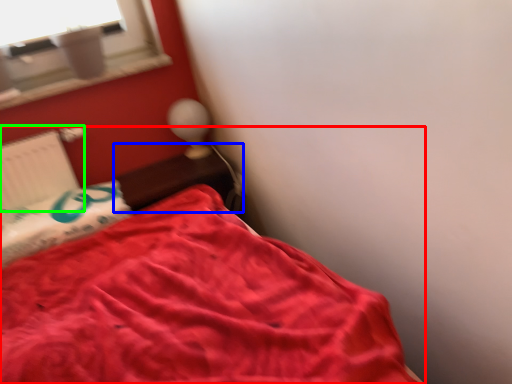
Question: Which object is positioned closest to bed (highlighted by a red box)? Select from table (highlighted by a blue box) and radiator (highlighted by a green box).

Choices:
 (A) table
 (B) radiator

Answer: (A)